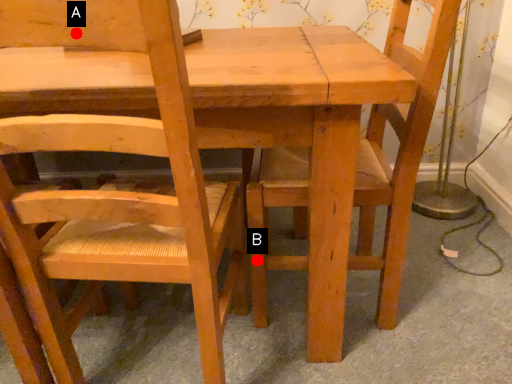
Question: Two points are circled on the image, labeled by A and B beside each circle. Which point is further to the camera?

Choices:
 (A) A is further
 (B) B is further

Answer: (B)